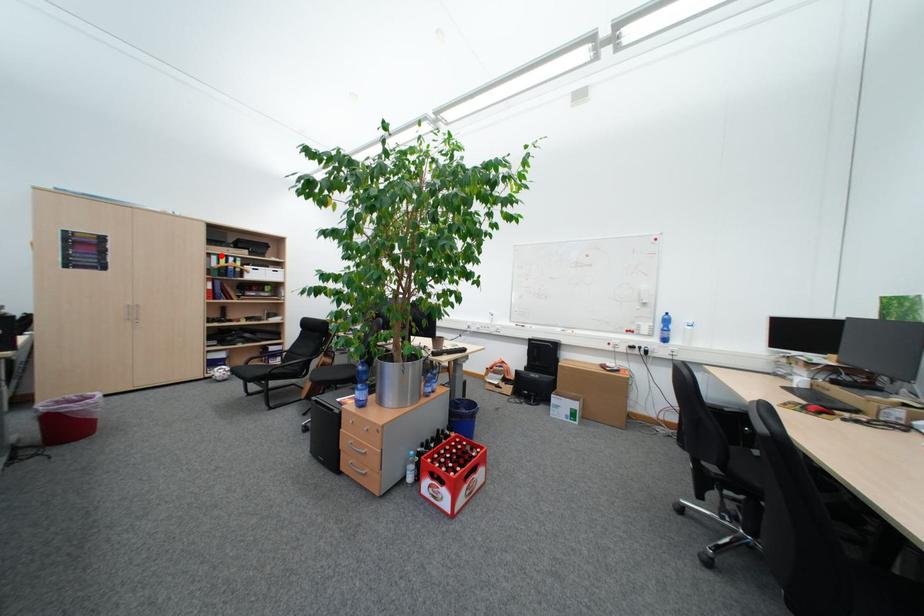
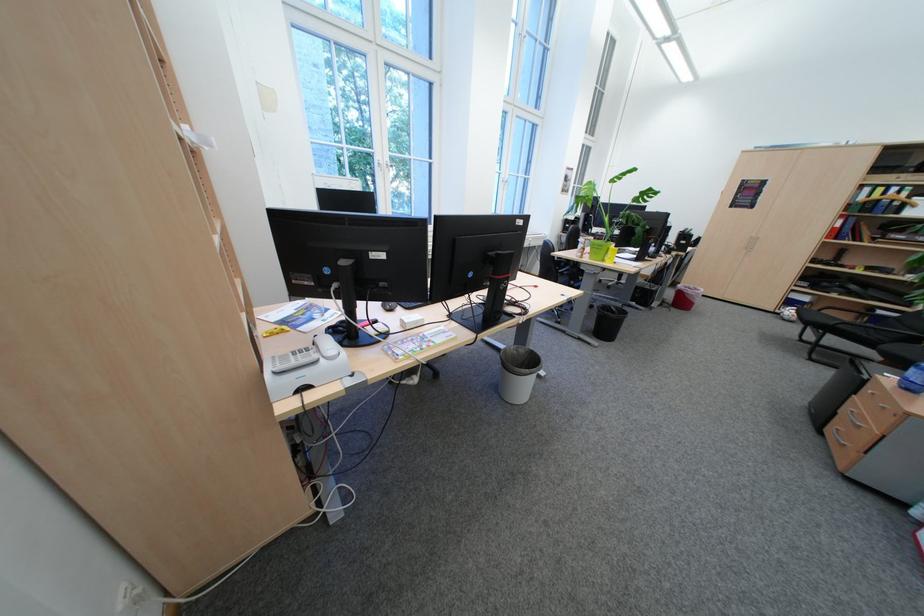
The point at the highlighted location is marked in the first image. Where is the corresponding point in the second image?

(873, 188)